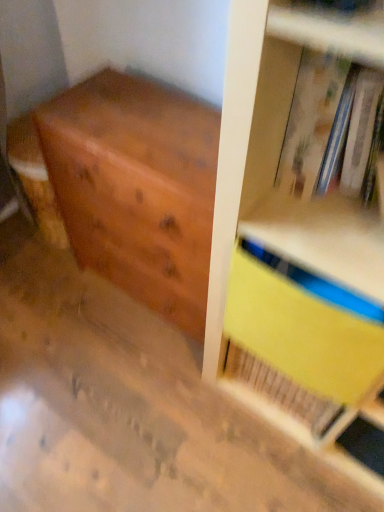
Describe the element at coordinates (300, 345) in the screenshot. The image size is (384, 512). I see `yellow matte paper at upper right` at that location.

Identify the location of wooden chest of drawers at left. This screenshot has width=384, height=512. (136, 188).

How different are the orientations of hardcover book at upper right and wooden chest of drawers at left in degrees?

hardcover book at upper right and wooden chest of drawers at left are facing 0.000158 degrees away from each other.

Which is nearer, (304, 192) or (188, 134)?

Point (304, 192) is closer to the camera than point (188, 134).

From the image's perspective, is hardcover book at upper right below wooden chest of drawers at left?

No, from the image's perspective, hardcover book at upper right is not beneath wooden chest of drawers at left.

Is hardcover book at upper right wider or thinner than wooden chest of drawers at left?

Considering their sizes, hardcover book at upper right looks slimmer than wooden chest of drawers at left.

Is yellow matte paper at upper right positioned beyond the bounds of wooden chest of drawers at left?

Yes.

Is point (231, 350) farther from camera compared to point (137, 143)?

Yes, it is.

Which object is positioned more to the left, yellow matte paper at upper right or wooden chest of drawers at left?

Positioned to the left is wooden chest of drawers at left.

From a real-world perspective, is yellow matte paper at upper right positioned above or below wooden chest of drawers at left?

In terms of real-world spatial position, yellow matte paper at upper right is above wooden chest of drawers at left.

Does point (146, 201) come farther from viewer compared to point (310, 96)?

Yes, it is.

Which object is positioned more to the left, wooden chest of drawers at left or hardcover book at upper right?

wooden chest of drawers at left.

Is wooden chest of drawers at left oriented away from hardcover book at upper right?

wooden chest of drawers at left is not turned away from hardcover book at upper right.

Considering the relative sizes of wooden chest of drawers at left and hardcover book at upper right in the image provided, is wooden chest of drawers at left bigger than hardcover book at upper right?

Yes.

Considering the relative sizes of hardcover book at upper right and yellow matte paper at upper right in the image provided, is hardcover book at upper right bigger than yellow matte paper at upper right?

Yes.

Is hardcover book at upper right inside the boundaries of yellow matte paper at upper right, or outside?

hardcover book at upper right is outside yellow matte paper at upper right.

From the image's perspective, is hardcover book at upper right located above yellow matte paper at upper right?

Yes, from the image's perspective, hardcover book at upper right is over yellow matte paper at upper right.

What are the coordinates of `paperback book on the left of hardcover book at upper right` in the screenshot? It's located at (300, 345).

Is yellow matte paper at upper right taller than hardcover book at upper right?

Yes.

Looking at this image, is hardcover book at upper right inside yellow matte paper at upper right?

Actually, hardcover book at upper right is outside yellow matte paper at upper right.

Which object is further away from the camera, yellow matte paper at upper right or hardcover book at upper right?

Positioned behind is yellow matte paper at upper right.

Does yellow matte paper at upper right have a smaller size compared to hardcover book at upper right?

Yes.

From a real-world perspective, is wooden chest of drawers at left physically below yellow matte paper at upper right?

Yes.

Is wooden chest of drawers at left taller or shorter than yellow matte paper at upper right?

In the image, wooden chest of drawers at left appears to be taller than yellow matte paper at upper right.

Is yellow matte paper at upper right completely or partially inside wooden chest of drawers at left?

No, yellow matte paper at upper right is not surrounded by wooden chest of drawers at left.

Which is behind, point (58, 116) or point (264, 276)?

Positioned behind is point (58, 116).

You are a GUI agent. You are given a task and a screenshot of the screen. Output one action in this format:
    pyautogui.click(x=<x>, y=<y>)
    Task: Click on the book above the wooden chest of drawers at left (from the image's perspective)
    The image size is (384, 512).
    Given the screenshot: What is the action you would take?
    pyautogui.click(x=327, y=126)

The width and height of the screenshot is (384, 512). There is a wooden chest of drawers at left. What are the coordinates of `paperback book above it (from a real-world perspective)` in the screenshot? It's located at (300, 345).

Consider the image. Looking at the image, which one is located further to hardcover book at upper right, yellow matte paper at upper right or wooden chest of drawers at left?

wooden chest of drawers at left is further to hardcover book at upper right.

From the image, which object appears to be farther from wooden chest of drawers at left, hardcover book at upper right or yellow matte paper at upper right?

Among the two, hardcover book at upper right is located further to wooden chest of drawers at left.

Looking at this image, from the image, which object appears to be farther from yellow matte paper at upper right, hardcover book at upper right or wooden chest of drawers at left?

The object further to yellow matte paper at upper right is wooden chest of drawers at left.

Which object lies nearer to the anchor point yellow matte paper at upper right, wooden chest of drawers at left or hardcover book at upper right?

hardcover book at upper right is closer to yellow matte paper at upper right.

Which object lies further to the anchor point wooden chest of drawers at left, yellow matte paper at upper right or hardcover book at upper right?

hardcover book at upper right lies further to wooden chest of drawers at left than the other object.

Based on their spatial positions, is wooden chest of drawers at left or yellow matte paper at upper right further from hardcover book at upper right?

Based on the image, wooden chest of drawers at left appears to be further to hardcover book at upper right.

Identify the location of paperback book between wooden chest of drawers at left and hardcover book at upper right from left to right. (300, 345).